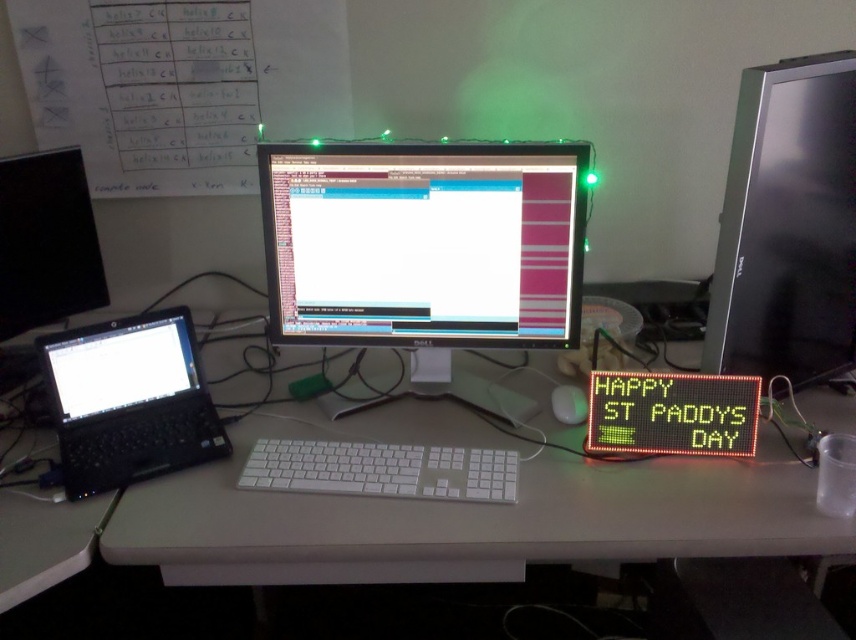
Find the location of `matte black monitor at right`. matte black monitor at right is located at coordinates 788,225.

This screenshot has width=856, height=640. What do you see at coordinates (788, 225) in the screenshot?
I see `matte black monitor at right` at bounding box center [788, 225].

This screenshot has width=856, height=640. Find the location of `matte black monitor at right`. matte black monitor at right is located at coordinates (788, 225).

Does satin black monitor at center appear on the right side of black plastic laptop at left?

Correct, you'll find satin black monitor at center to the right of black plastic laptop at left.

From the picture: Who is positioned more to the right, satin black monitor at center or black plastic laptop at left?

satin black monitor at center is more to the right.

The width and height of the screenshot is (856, 640). Describe the element at coordinates (425, 256) in the screenshot. I see `satin black monitor at center` at that location.

Where is `satin black monitor at center`? satin black monitor at center is located at coordinates (425, 256).

Can you confirm if satin black monitor at center is positioned to the right of black plastic mouse at center?

In fact, satin black monitor at center is to the left of black plastic mouse at center.

Which is behind, point (482, 392) or point (557, 403)?

The point (482, 392) is behind.

You are a GUI agent. You are given a task and a screenshot of the screen. Output one action in this format:
    pyautogui.click(x=<x>, y=<y>)
    Task: Click on the satin black monitor at center
    This screenshot has width=856, height=640.
    Given the screenshot: What is the action you would take?
    pyautogui.click(x=425, y=256)